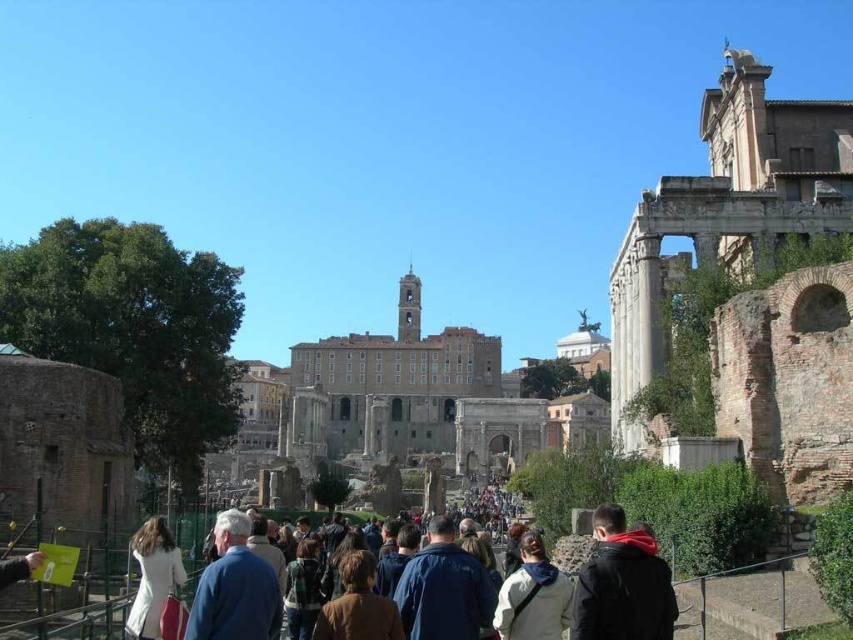
You are a tour guide at the Roman Forum and notice two visitors wearing white outerwear. You see the white cotton jacket at center and the white matte coat at lower left. Which one is closer to you?

The white cotton jacket at center is closer to you because it is in front of the white matte coat at lower left.

You are standing at the point marked as point [233,532]. You want to walk to the Temple of Saturn, which is 44.20 meters away. Is the Temple of Saturn located in the direction you are facing?

The Temple of Saturn is 44.20 meters away from point [233,532]. Since the tourists in the foreground are walking away from the camera, their direction might indicate the path. However, without specific directional data, we cannot confirm if the Temple of Saturn is directly in front of you. Please refer to a map or ask a local guide for directions.

You are a photographer standing at the Roman Forum. You want to take a photo that includes both the point at coordinates point (x=592, y=563) and point (x=148, y=618). Which point should you focus on first to ensure both are in sharp focus?

You should focus on point (x=592, y=563) first because it is closer to the camera than point (x=148, y=618), ensuring both points are within the depth of field.